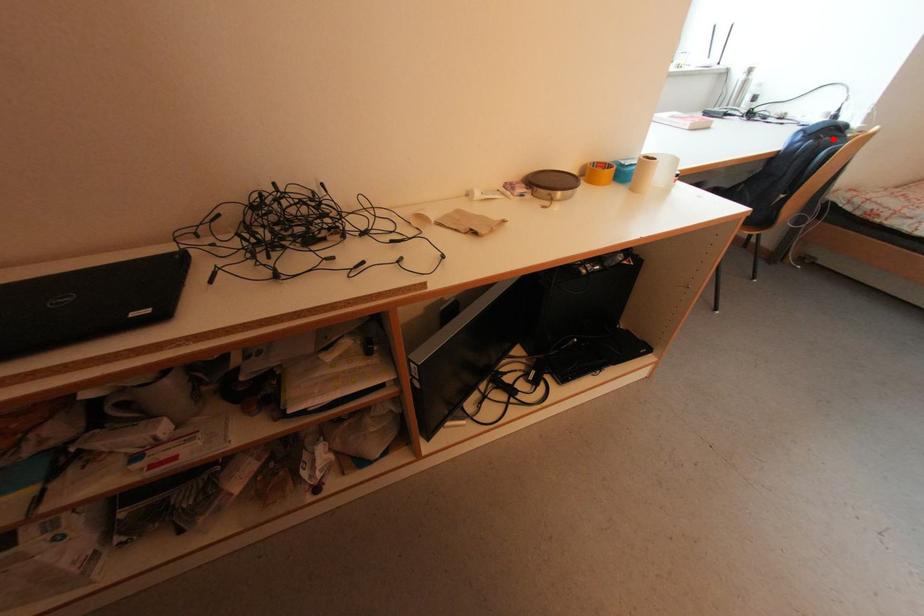
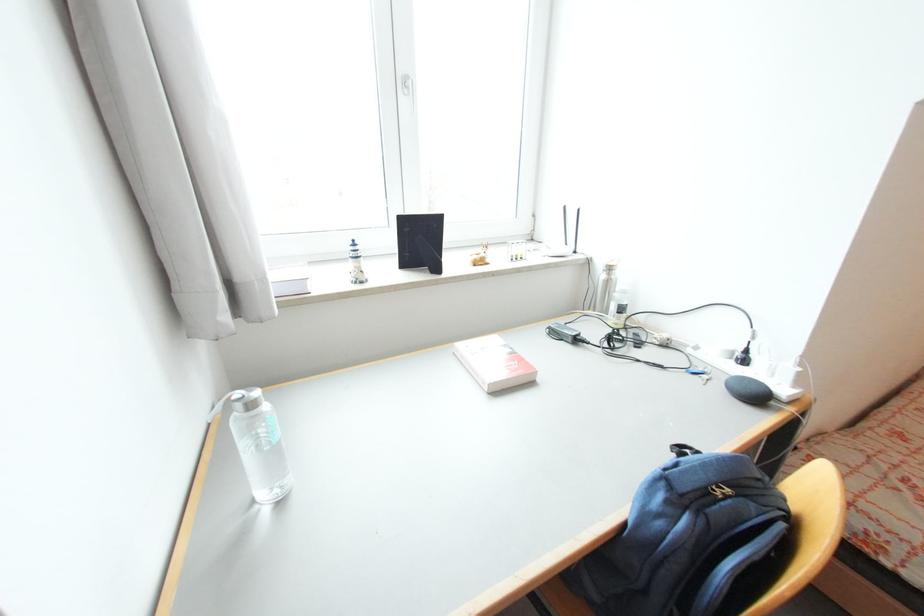
The point at the highlighted location is marked in the first image. Where is the corresponding point in the second image?

(734, 492)